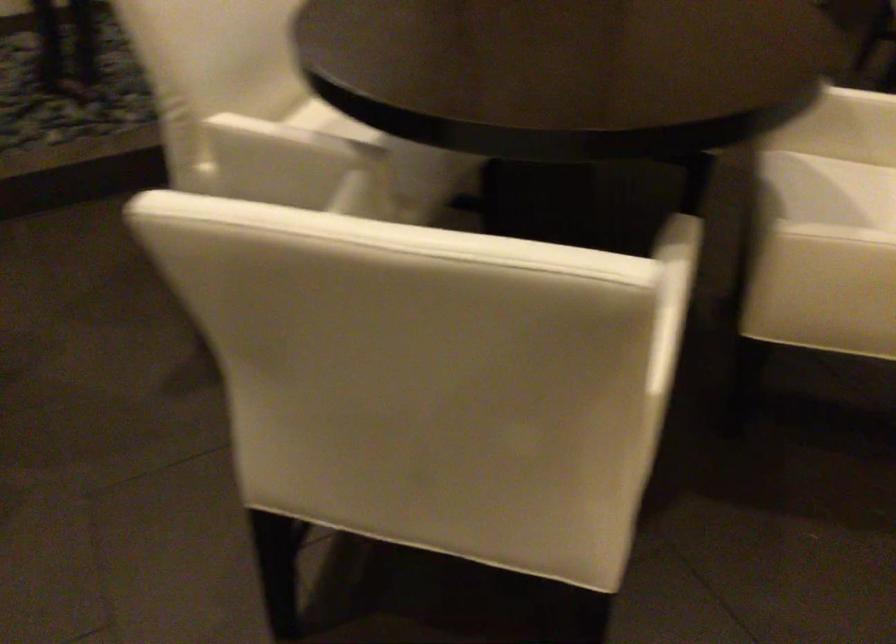
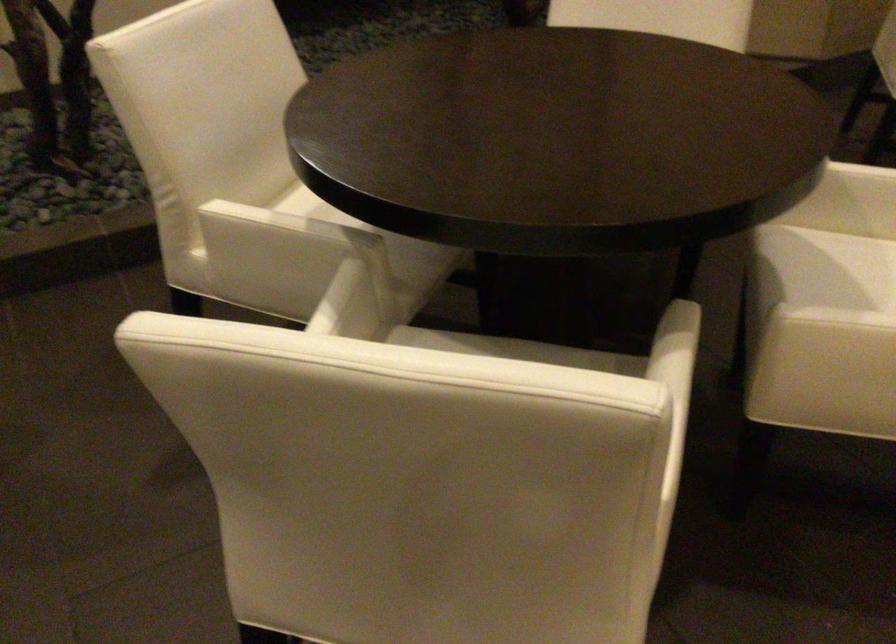
Find the pixel in the second image that matches point (277, 147) in the first image.

(270, 236)